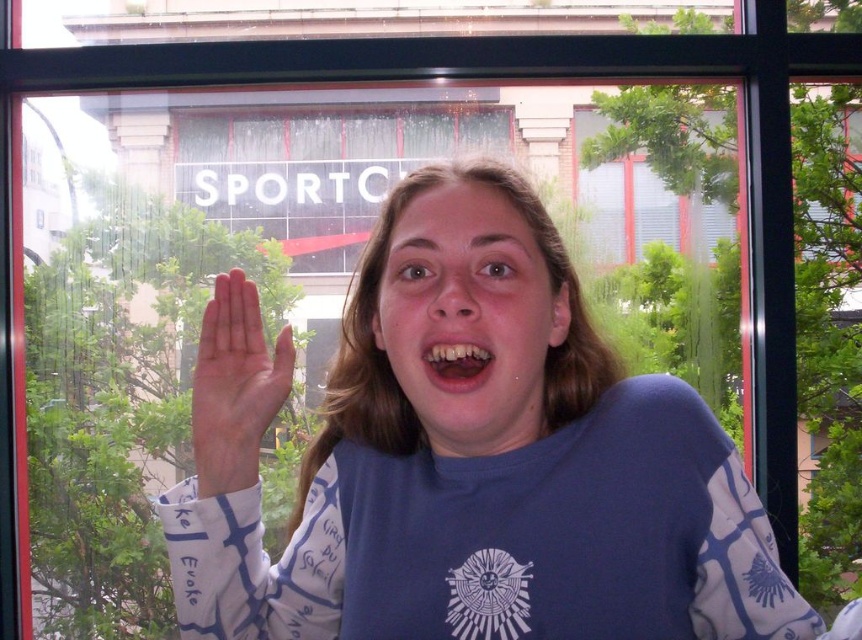
You are a fashion designer analyzing the image. You need to determine the exact position of the blue cotton shirt at center. What are its coordinates?

The blue cotton shirt at center is located at point (467, 460).

You are designing a layout for a magazine cover and need to place two elements based on their sizes. The blue cotton shirt at center and the matte skin face at center are the elements. Which element should you place higher on the cover to maintain proportion?

The blue cotton shirt at center should be placed higher on the cover since it has a greater height compared to the matte skin face at center.

You are a photographer trying to capture a closeup of the person waving. You want to ensure both the pink smooth palm at center and the yellowish matte teeth at center are clearly visible in the shot. Given their sizes, which object should you focus on to ensure both are in frame without needing to zoom in or out?

The pink smooth palm at center is wider than the yellowish matte teeth at center, so focusing on the pink smooth palm at center will ensure both are in frame without needing to adjust the zoom.